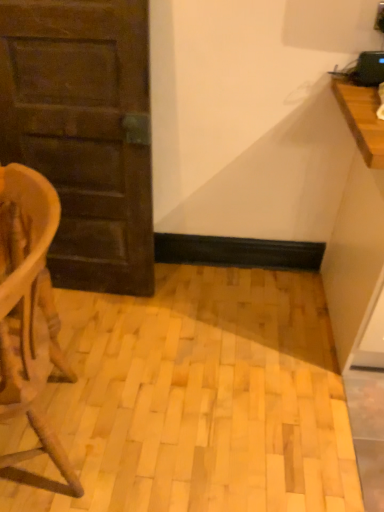
This screenshot has width=384, height=512. What do you see at coordinates (29, 310) in the screenshot?
I see `wooden chair at left` at bounding box center [29, 310].

Find the location of `wooden chair at left`. wooden chair at left is located at coordinates tap(29, 310).

The image size is (384, 512). Find the location of `wooden chair at left`. wooden chair at left is located at coordinates (29, 310).